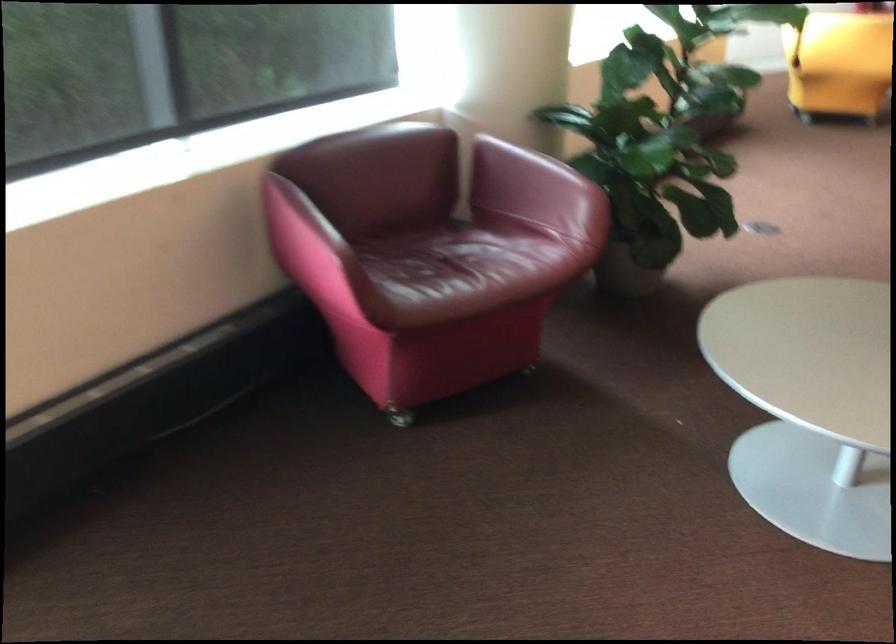
Describe the element at coordinates (426, 212) in the screenshot. Image resolution: width=896 pixels, height=644 pixels. I see `a chair caster wheel` at that location.